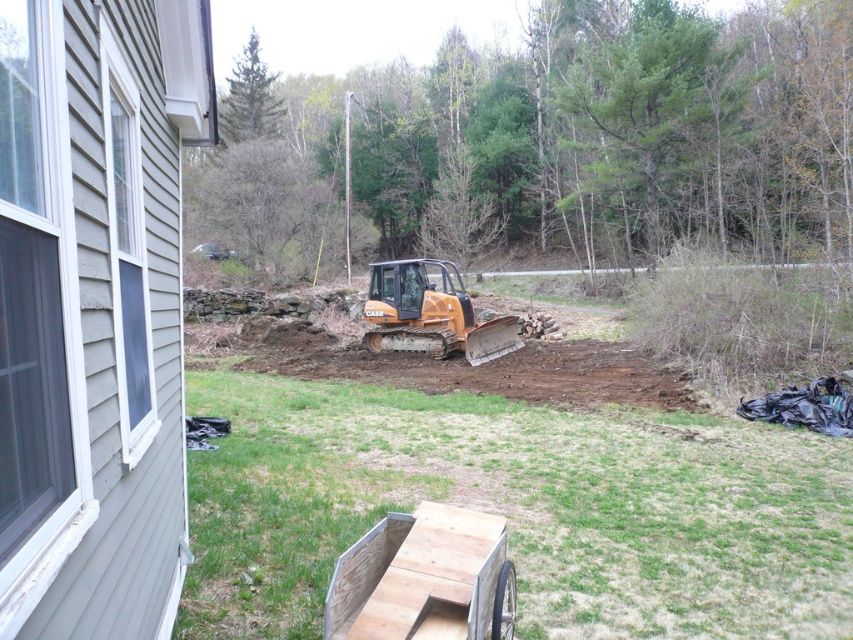
Is orange compact tractor at center positioned behind orange rubber plow at center?

No, it is not.

Does orange compact tractor at center appear under orange rubber plow at center?

Yes.

Find the location of a particular element. orange compact tractor at center is located at coordinates (519, 508).